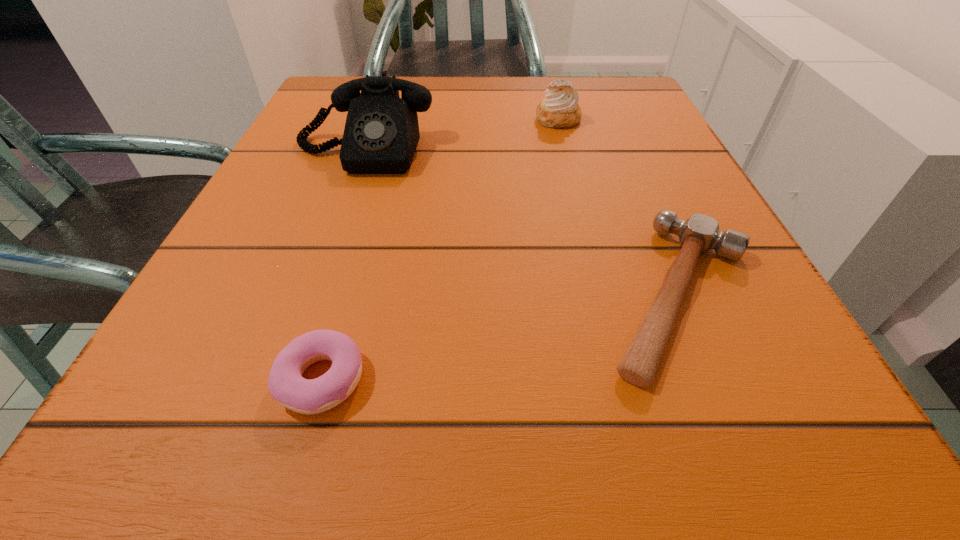
You are a GUI agent. You are given a task and a screenshot of the screen. Output one action in this format:
    pyautogui.click(x=<x>, y=<y>)
    Task: Click on the unoccupied area between the hammer and the right pastry
    The image size is (960, 540).
    Given the screenshot: What is the action you would take?
    pyautogui.click(x=619, y=207)

The width and height of the screenshot is (960, 540). I want to click on empty location between the tallest object and the left pastry, so click(x=343, y=265).

Where is `unoccupied position between the farther pastry and the telephone`? The height and width of the screenshot is (540, 960). unoccupied position between the farther pastry and the telephone is located at coordinates (461, 136).

At what (x,y) coordinates should I click in order to perform the action: click on vacant space in between the hammer and the tallest object. Please return your answer as a coordinate pair (x, y). Looking at the image, I should click on (521, 223).

You are a GUI agent. You are given a task and a screenshot of the screen. Output one action in this format:
    pyautogui.click(x=<x>, y=<y>)
    Task: Click on the second closest object to the left pastry
    Image resolution: width=960 pixels, height=540 pixels.
    Given the screenshot: What is the action you would take?
    pyautogui.click(x=381, y=134)

Find the location of a particular element. Image resolution: width=960 pixels, height=540 pixels. object that can be found as the closest to the nearer pastry is located at coordinates (699, 233).

Locate an element on the screen. The image size is (960, 540). vacant position in the image that satisfies the following two spatial constraints: 1. on the dial of the shorter pastry; 2. on the left side of the telephone is located at coordinates (283, 379).

Image resolution: width=960 pixels, height=540 pixels. In order to click on vacant region that satisfies the following two spatial constraints: 1. on the dial of the tallest object; 2. on the left side of the hammer in this screenshot , I will do `click(313, 295)`.

You are a GUI agent. You are given a task and a screenshot of the screen. Output one action in this format:
    pyautogui.click(x=<x>, y=<y>)
    Task: Click on the free spot that satisfies the following two spatial constraints: 1. on the dial of the tallest object; 2. on the right side of the nearer pastry
    This screenshot has width=960, height=540.
    Given the screenshot: What is the action you would take?
    283,379

Where is `free location that satisfies the following two spatial constraints: 1. on the back side of the farther pastry; 2. on the right side of the nearer pastry`? The width and height of the screenshot is (960, 540). free location that satisfies the following two spatial constraints: 1. on the back side of the farther pastry; 2. on the right side of the nearer pastry is located at coordinates tap(396, 119).